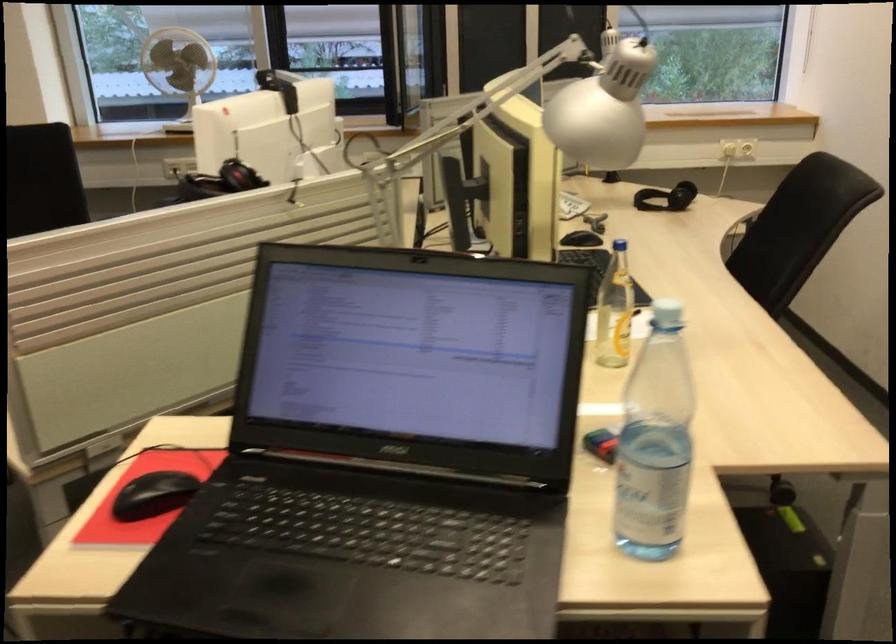
The location [153,495] corresponds to which object?

This point indicates the black computer mouse.